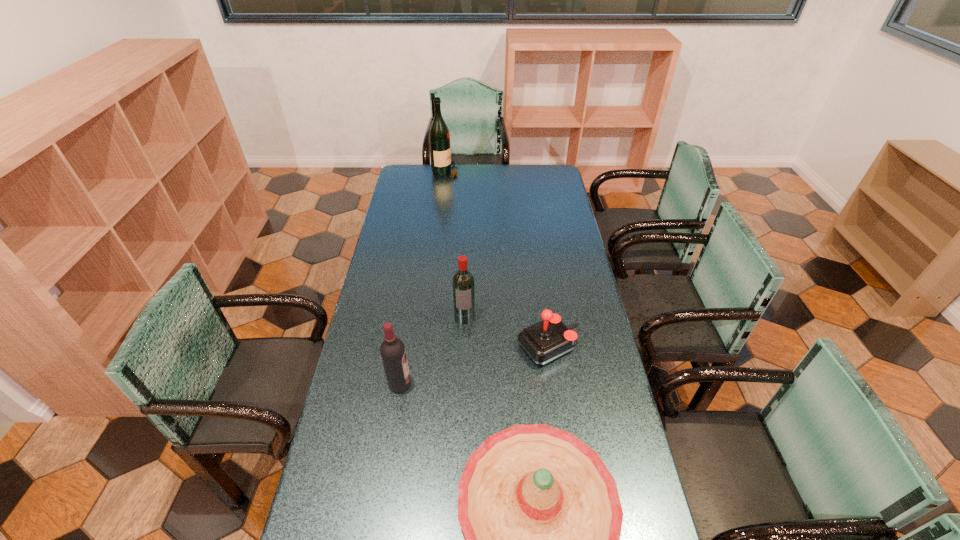
Locate an element on the screen. the farthest object is located at coordinates (439, 137).

Locate an element on the screen. The image size is (960, 540). the tallest object is located at coordinates (439, 137).

You are a GUI agent. You are given a task and a screenshot of the screen. Output one action in this format:
    pyautogui.click(x=<x>, y=<y>)
    Task: Click on the fourth farthest object
    
    Given the screenshot: What is the action you would take?
    pyautogui.click(x=392, y=350)

Where is `the second nearest wine bottle`? The image size is (960, 540). the second nearest wine bottle is located at coordinates (463, 281).

Identify the location of the rightmost wine bottle. The width and height of the screenshot is (960, 540). (463, 281).

Where is `the third farthest object`? the third farthest object is located at coordinates (548, 339).

Find the location of a particular element. The height and width of the screenshot is (540, 960). vacant space located 0.150m on the surface of the tallest object is located at coordinates (487, 171).

The width and height of the screenshot is (960, 540). Identify the location of vacant space situated 0.210m on the label of the second nearest object. (475, 384).

Where is `free spot located on the label of the fourth nearest object`? free spot located on the label of the fourth nearest object is located at coordinates (463, 382).

Where is `vacant space located 0.400m on the front of the joystick`? The height and width of the screenshot is (540, 960). vacant space located 0.400m on the front of the joystick is located at coordinates (569, 491).